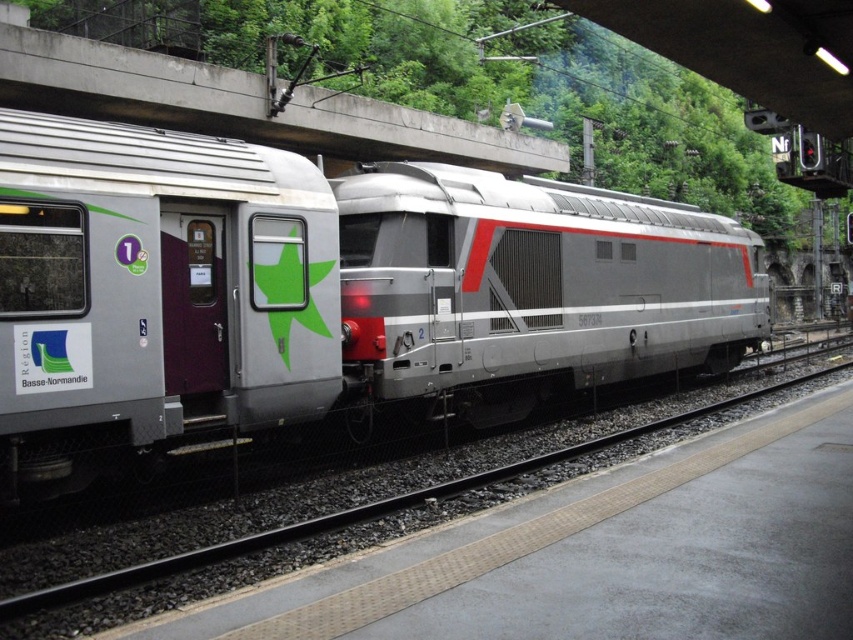
Who is lower down, silver metallic train car at center or metal track at center?

metal track at center is below.

Does silver metallic train car at center appear on the left side of metal track at center?

Indeed, silver metallic train car at center is positioned on the left side of metal track at center.

Between point (91, 372) and point (107, 618), which one is positioned in front?

Point (107, 618) is more forward.

In order to click on silver metallic train car at center in this screenshot , I will do 154,292.

Does silver metallic train car at center appear over concrete at upper center?

Actually, silver metallic train car at center is below concrete at upper center.

Locate an element on the screen. silver metallic train car at center is located at coordinates (154, 292).

Is point (334, 340) closer to viewer compared to point (112, 60)?

Yes, point (334, 340) is in front of point (112, 60).

Locate an element on the screen. silver metallic train car at center is located at coordinates (154, 292).

Which of these two, metal track at center or concrete at upper center, stands shorter?

metal track at center is shorter.

Is metal track at center wider than concrete at upper center?

Yes.

Who is more distant from viewer, (798, 372) or (144, 84)?

The point (798, 372) is behind.

Image resolution: width=853 pixels, height=640 pixels. I want to click on metal track at center, so click(x=339, y=512).